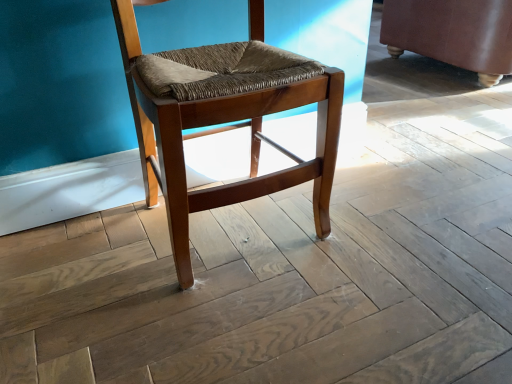
Question: Is wooden woven seat at center spatially inside brown leather swivel chair at right, or outside of it?

Choices:
 (A) outside
 (B) inside

Answer: (A)

Question: Is wooden woven seat at center wider or thinner than brown leather swivel chair at right?

Choices:
 (A) wide
 (B) thin

Answer: (B)

Question: Is point (126, 13) positioned closer to the camera than point (421, 16)?

Choices:
 (A) farther
 (B) closer

Answer: (B)

Question: Considering their positions, is brown leather swivel chair at right located in front of or behind wooden woven seat at center?

Choices:
 (A) behind
 (B) front

Answer: (A)

Question: Considering the positions of point (502, 67) and point (253, 129), is point (502, 67) closer or farther from the camera than point (253, 129)?

Choices:
 (A) farther
 (B) closer

Answer: (A)

Question: From a real-world perspective, is brown leather swivel chair at right physically located above or below wooden woven seat at center?

Choices:
 (A) below
 (B) above

Answer: (A)

Question: Looking at their shapes, would you say brown leather swivel chair at right is wider or thinner than wooden woven seat at center?

Choices:
 (A) wide
 (B) thin

Answer: (A)